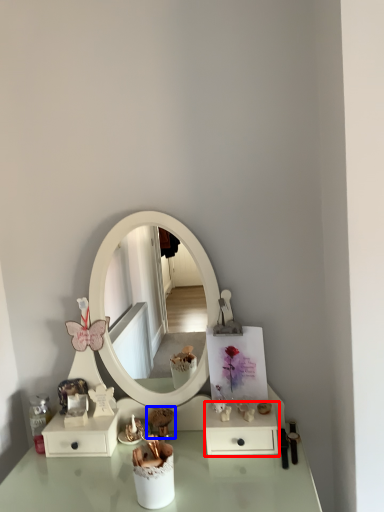
Question: Among these objects, which one is nearest to the camera, dresser (highlighted by a red box) or toy (highlighted by a blue box)?

Choices:
 (A) dresser
 (B) toy

Answer: (A)